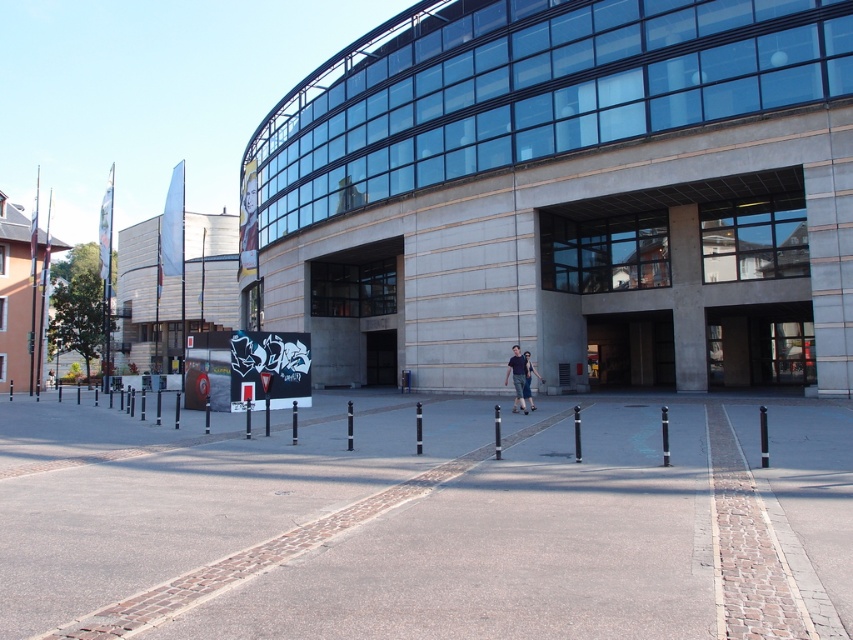
You are a photographer trying to capture both the denim pants at center and the dark blue jeans at center in a single frame. Which object will appear larger in the photo?

The denim pants at center will appear larger in the photo because it has a larger size compared to the dark blue jeans at center.

You are standing in front of the modern building and notice two points marked in the scene. The first point is at coordinates point [514,358] and the second is at point [527,369]. Which of these two points is closer to your current position?

Point [514,358] is further to the camera than point [527,369], so the point closer to your position is point [527,369].

You are a fashion designer observing two outfits in the plaza. You need to decide if they can be displayed side by side in a window display that is 60 centimeters wide. The outfits are the denim pants at center and dark blue jeans at center. Can they fit together in the display?

The denim pants at center and dark blue jeans at center are 64.44 centimeters apart, which is wider than the 60 centimeter display. They cannot fit together in the display.